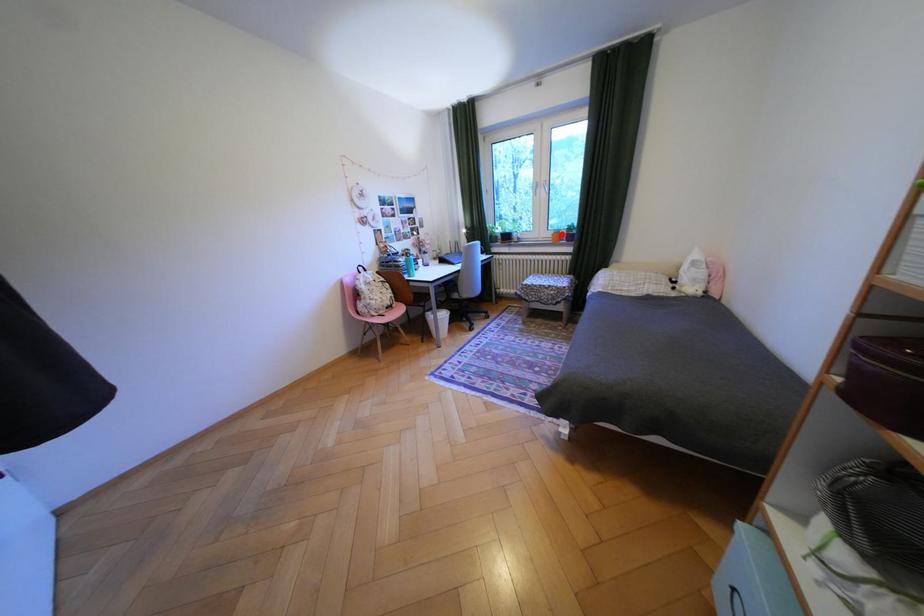
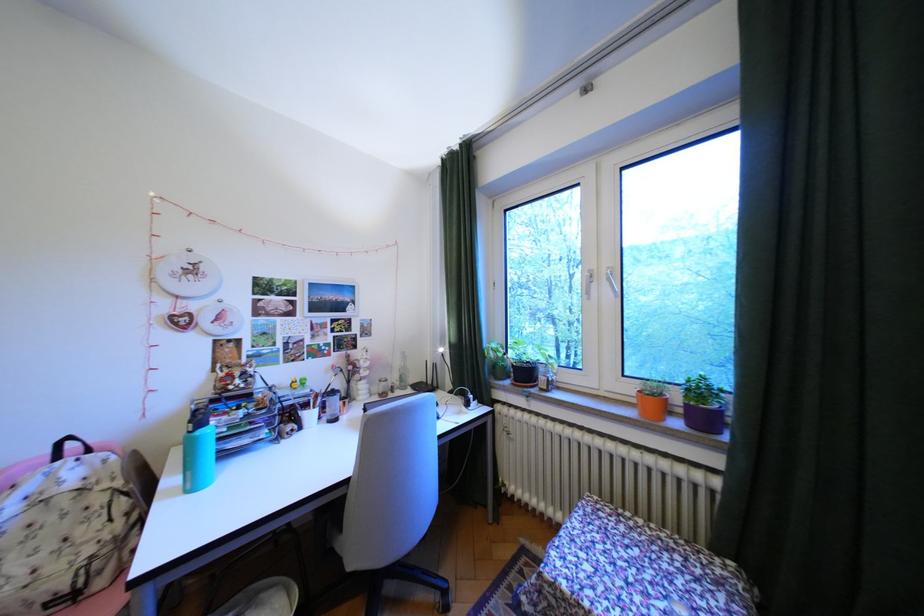
Question: I am providing you with two images of the same scene from different viewpoints. Given a red point in image1, look at the same physical point in image2. Is it:

Choices:
 (A) Closer to the viewpoint
 (B) Farther from the viewpoint

Answer: (B)